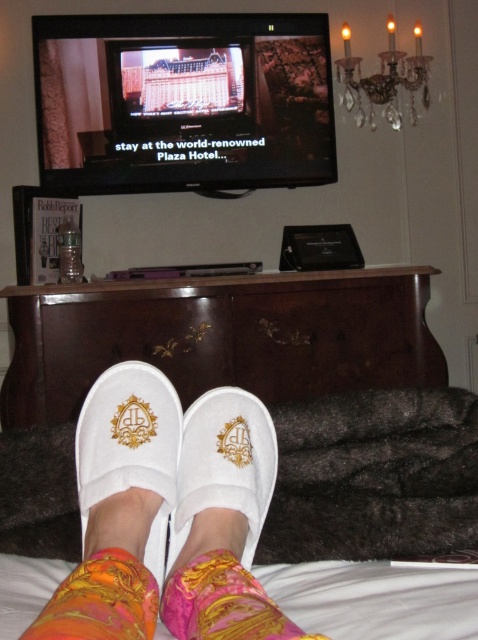
Does white wood dresser at center appear on the right side of white fabric slipper at center?

In fact, white wood dresser at center is to the left of white fabric slipper at center.

Who is shorter, white wood dresser at center or white fabric slipper at center?

white fabric slipper at center is shorter.

What do you see at coordinates (221, 337) in the screenshot? The height and width of the screenshot is (640, 478). I see `white wood dresser at center` at bounding box center [221, 337].

Find the location of a particular element. The height and width of the screenshot is (640, 478). white wood dresser at center is located at coordinates (221, 337).

Which is more to the left, white fabric slipper at lower center or white fabric slipper at center?

white fabric slipper at lower center

Consider the image. Is white fabric slipper at lower center thinner than white fabric slipper at center?

No, white fabric slipper at lower center is not thinner than white fabric slipper at center.

The width and height of the screenshot is (478, 640). What do you see at coordinates (130, 458) in the screenshot?
I see `white fabric slipper at lower center` at bounding box center [130, 458].

The image size is (478, 640). I want to click on white fabric slipper at lower center, so click(x=130, y=458).

Which is below, white wood dresser at center or pink satin sock at lower center?

pink satin sock at lower center

Is the position of white wood dresser at center less distant than that of pink satin sock at lower center?

No, it is behind pink satin sock at lower center.

This screenshot has width=478, height=640. Identify the location of white wood dresser at center. (221, 337).

Locate an element on the screen. The image size is (478, 640). white wood dresser at center is located at coordinates (221, 337).